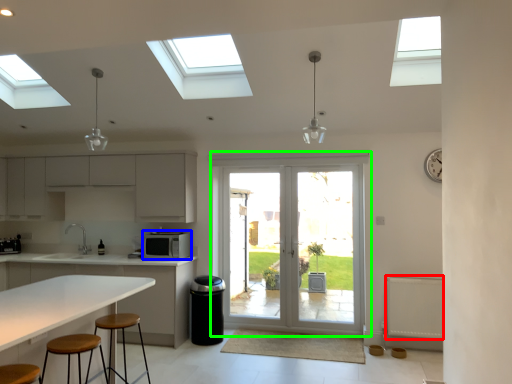
Question: Considering the real-world distances, which object is closest to radiator (highlighted by a red box)? appliance (highlighted by a blue box) or door (highlighted by a green box).

Choices:
 (A) appliance
 (B) door

Answer: (B)